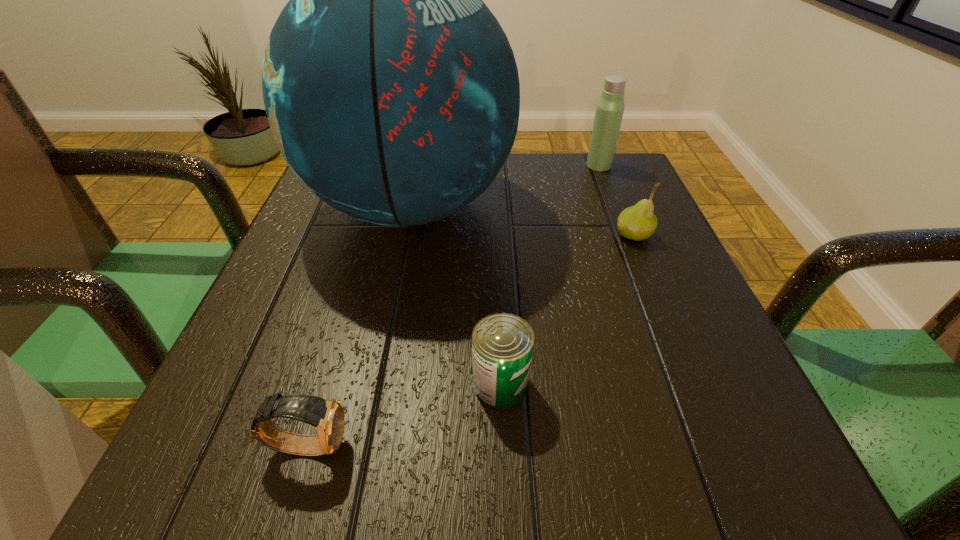
Where is `globe`? This screenshot has width=960, height=540. globe is located at coordinates (392, 92).

The height and width of the screenshot is (540, 960). I want to click on thermos bottle, so click(609, 111).

Identify the location of pear. (638, 222).

At what (x,y) coordinates should I click in order to perform the action: click on the fourth farthest object. Please return your answer as a coordinate pair (x, y). The width and height of the screenshot is (960, 540). Looking at the image, I should click on (502, 344).

Find the location of a particular element. The image size is (960, 540). the nearest object is located at coordinates (327, 416).

Locate an element on the screen. free space located 0.250m on the front of the tallest object is located at coordinates (371, 403).

At what (x,y) coordinates should I click in order to perform the action: click on free point located 0.210m on the front of the second tallest object. Please return your answer as a coordinate pair (x, y). The image size is (960, 540). Looking at the image, I should click on (622, 225).

What are the coordinates of `free region located on the left of the pear` in the screenshot? It's located at (487, 235).

Locate an element on the screen. Image resolution: width=960 pixels, height=540 pixels. vacant space located 0.080m on the left of the can is located at coordinates (416, 384).

At what (x,y) coordinates should I click in order to perform the action: click on vacant position located on the face of the nearest object. Please return your answer as a coordinate pair (x, y). The image size is (960, 540). Looking at the image, I should click on (468, 445).